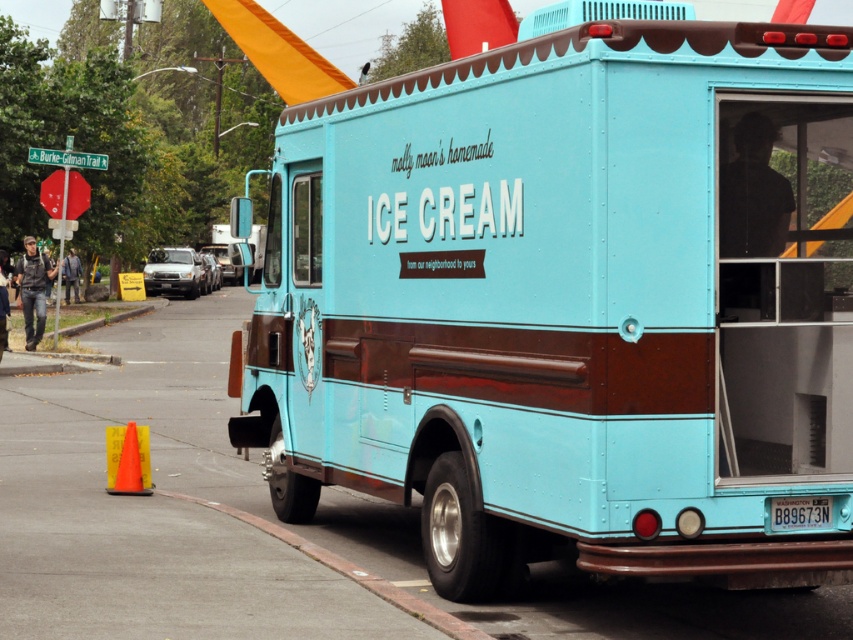
Question: Is yellow plastic cone at lower left closer to the viewer compared to blue plastic license plate at rear?

Choices:
 (A) no
 (B) yes

Answer: (A)

Question: Can you confirm if red brick curb at lower center is bigger than blue plastic license plate at rear?

Choices:
 (A) no
 (B) yes

Answer: (B)

Question: Which object appears farthest from the camera in this image?

Choices:
 (A) red brick curb at lower center
 (B) yellow plastic cone at lower left

Answer: (B)

Question: Among these objects, which one is farthest from the camera?

Choices:
 (A) red brick curb at lower center
 (B) matte blue ice cream truck at center
 (C) yellow plastic cone at lower left
 (D) blue plastic license plate at rear

Answer: (C)

Question: Can you confirm if red brick curb at lower center is positioned above blue plastic license plate at rear?

Choices:
 (A) no
 (B) yes

Answer: (A)

Question: Estimate the real-world distances between objects in this image. Which object is farther from the blue plastic license plate at rear?

Choices:
 (A) yellow plastic cone at lower left
 (B) matte blue ice cream truck at center
 (C) red brick curb at lower center

Answer: (A)